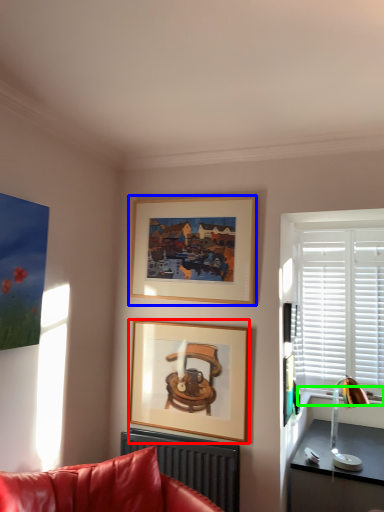
Question: Considering the real-world distances, which object is farthest from picture frame (highlighted by a red box)? picture frame (highlighted by a blue box) or window sill (highlighted by a green box)?

Choices:
 (A) picture frame
 (B) window sill

Answer: (B)